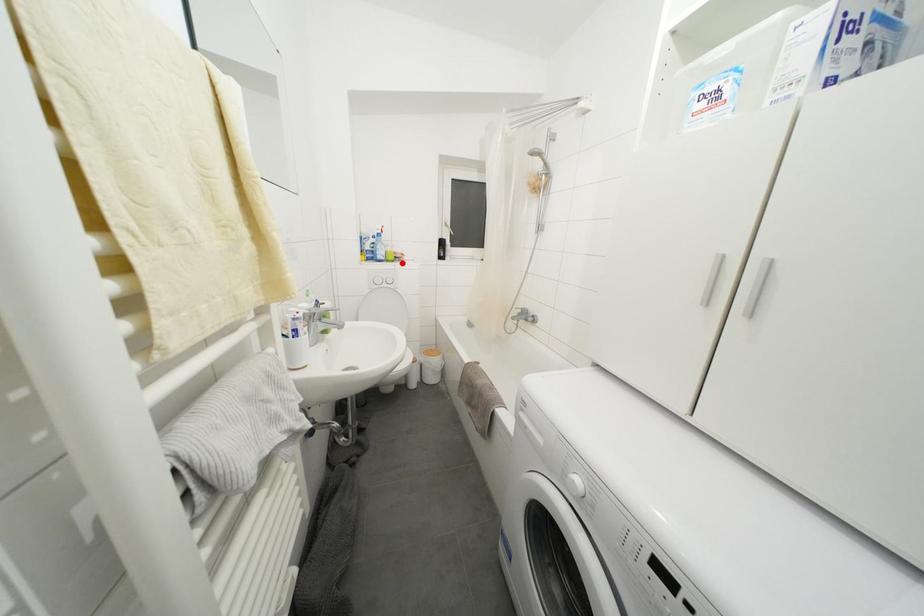
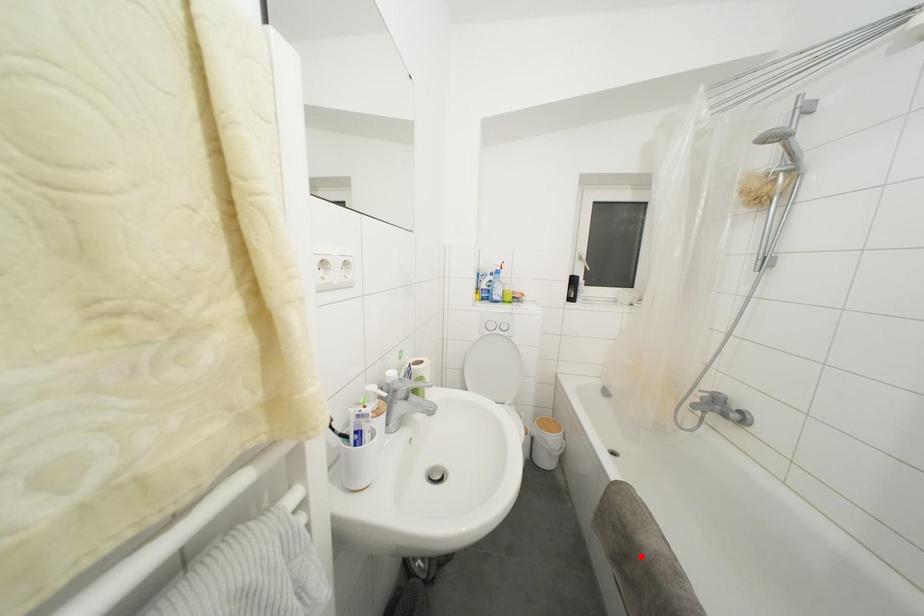
I am providing you with two images of the same scene from different viewpoints. A red point is marked on the first image and another point is marked on the second image. Is the red point in image1 aligned with the point shown in image2?

No